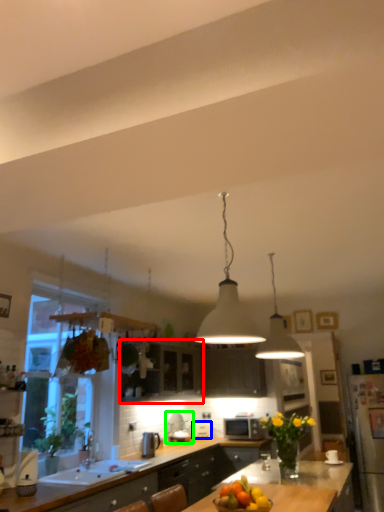
Question: Which is nearer to the cabinetry (highlighted by a red box)? appliance (highlighted by a blue box) or appliance (highlighted by a green box).

Choices:
 (A) appliance
 (B) appliance

Answer: (B)